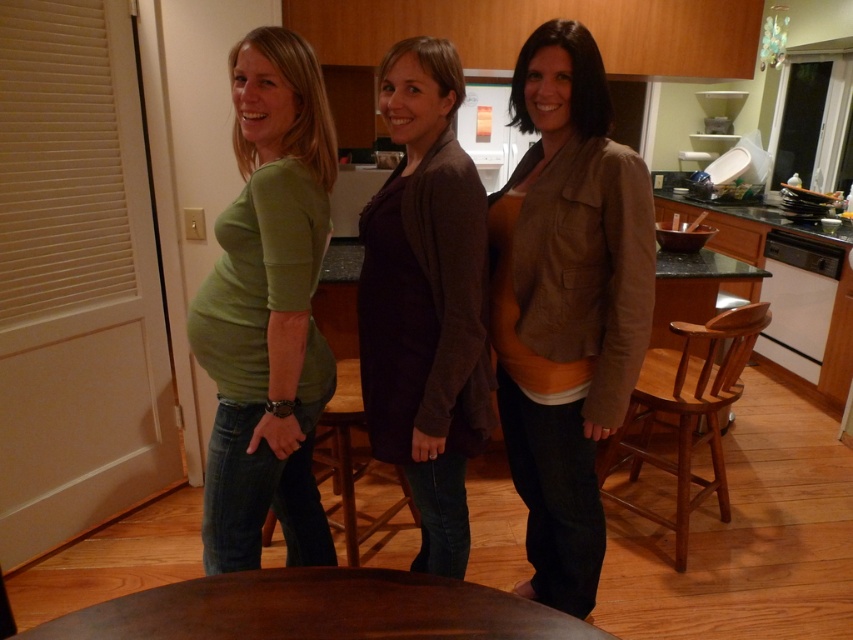
Is green matte shirt at left shorter than dark brown sweater at center?

Yes.

Who is lower down, green matte shirt at left or dark brown sweater at center?

dark brown sweater at center is lower down.

Where is `green matte shirt at left`? Image resolution: width=853 pixels, height=640 pixels. green matte shirt at left is located at coordinates (267, 310).

Is point (503, 372) closer to camera compared to point (289, 67)?

No, it is behind (289, 67).

Who is lower down, brown cotton jacket at center or green matte shirt at left?

brown cotton jacket at center is lower down.

Locate an element on the screen. The height and width of the screenshot is (640, 853). brown cotton jacket at center is located at coordinates (566, 304).

Can you confirm if green matte shirt at left is bigger than brown wooden table at center?

Correct, green matte shirt at left is larger in size than brown wooden table at center.

Which is above, green matte shirt at left or brown wooden table at center?

green matte shirt at left is above.

Is point (225, 460) positioned after point (190, 595)?

Yes, point (225, 460) is behind point (190, 595).

Where is `green matte shirt at left`? green matte shirt at left is located at coordinates (267, 310).